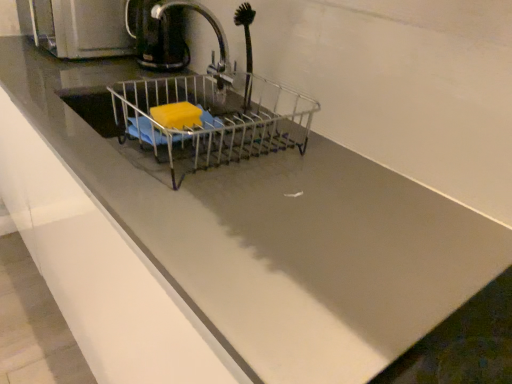
I want to click on free region under metallic wire basket at center (from a real-world perspective), so click(227, 160).